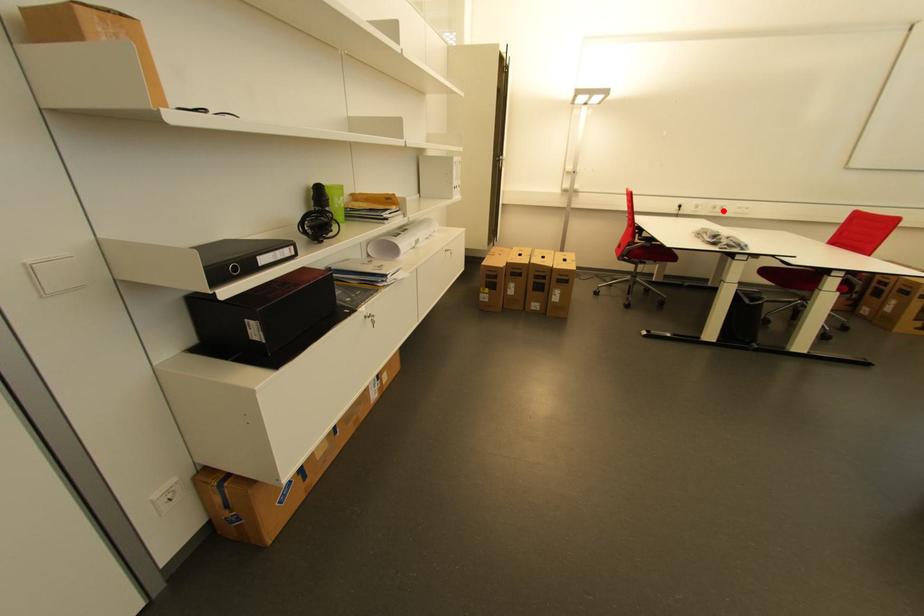
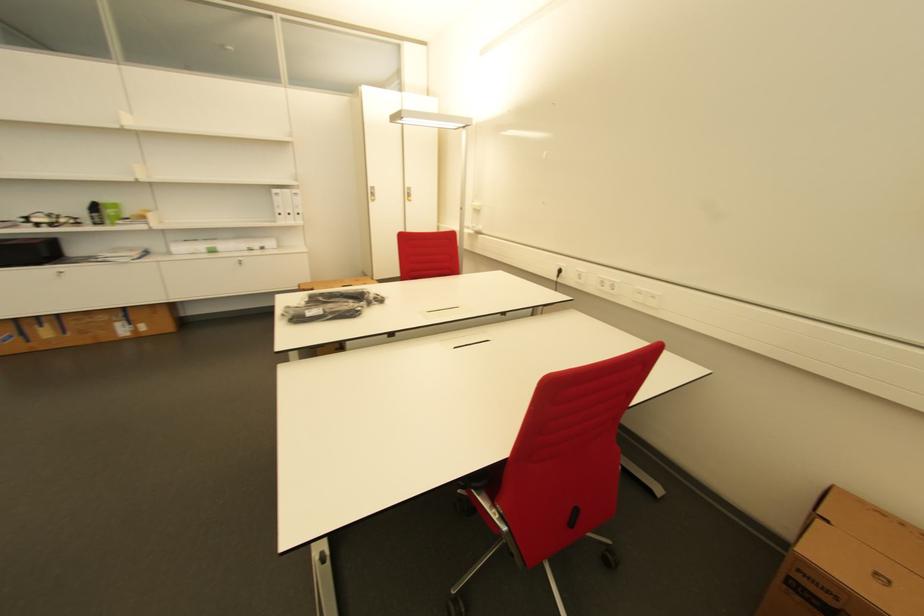
Locate, in the second image, the point that corresponds to the highlighted location in the first image.

(612, 289)